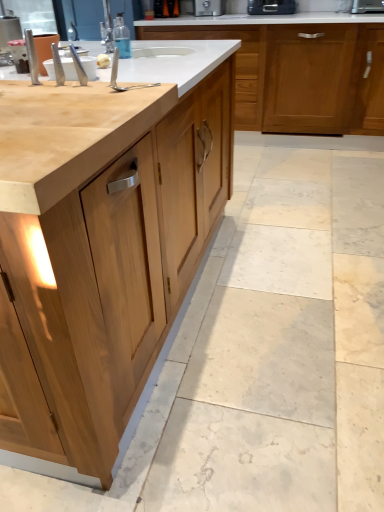
Question: Is natural wood cabinet at center, which is counted as the 2th cabinetry, starting from the back, far from black plastic toaster at upper center, which ranks as the 1th appliance in left-to-right order?

Choices:
 (A) no
 (B) yes

Answer: (B)

Question: Can black plastic toaster at upper center, which ranks as the 1th appliance in left-to-right order, be found inside natural wood cabinet at center, which is the 1th cabinetry in front-to-back order?

Choices:
 (A) no
 (B) yes

Answer: (A)

Question: From a real-world perspective, is natural wood cabinet at center, which is the 1th cabinetry in front-to-back order, below black plastic toaster at upper center, which ranks as the 1th appliance in left-to-right order?

Choices:
 (A) no
 (B) yes

Answer: (B)

Question: Is natural wood cabinet at center, which is the 1th cabinetry in front-to-back order, further to camera compared to black plastic toaster at upper center, which ranks as the 1th appliance in left-to-right order?

Choices:
 (A) no
 (B) yes

Answer: (A)

Question: Considering the relative sizes of natural wood cabinet at center, which is counted as the 2th cabinetry, starting from the back, and black plastic toaster at upper center, which ranks as the 1th appliance in left-to-right order, in the image provided, is natural wood cabinet at center, which is counted as the 2th cabinetry, starting from the back, thinner than black plastic toaster at upper center, which ranks as the 1th appliance in left-to-right order,?

Choices:
 (A) yes
 (B) no

Answer: (B)

Question: Visually, is transparent plastic bottle at upper center positioned to the left or to the right of matte wood cabinet at center, the first cabinetry positioned from the back?

Choices:
 (A) left
 (B) right

Answer: (A)

Question: Considering the positions of point (127, 53) and point (258, 78), is point (127, 53) closer or farther from the camera than point (258, 78)?

Choices:
 (A) farther
 (B) closer

Answer: (B)

Question: Is transparent plastic bottle at upper center in front of or behind matte wood cabinet at center, the first cabinetry positioned from the back, in the image?

Choices:
 (A) front
 (B) behind

Answer: (A)

Question: Is transparent plastic bottle at upper center bigger or smaller than matte wood cabinet at center, the first cabinetry positioned from the back?

Choices:
 (A) small
 (B) big

Answer: (A)

Question: Is matte wood cabinet at center, the first cabinetry positioned from the back, inside the boundaries of transparent plastic bottle at upper center, or outside?

Choices:
 (A) outside
 (B) inside

Answer: (A)

Question: In the image, is matte wood cabinet at center, the first cabinetry positioned from the back, on the left side or the right side of transparent plastic bottle at upper center?

Choices:
 (A) left
 (B) right

Answer: (B)

Question: Looking at their shapes, would you say matte wood cabinet at center, the first cabinetry positioned from the back, is wider or thinner than transparent plastic bottle at upper center?

Choices:
 (A) thin
 (B) wide

Answer: (B)

Question: In terms of size, does matte wood cabinet at center, the 2th cabinetry in the front-to-back sequence, appear bigger or smaller than transparent plastic bottle at upper center?

Choices:
 (A) small
 (B) big

Answer: (B)

Question: Considering the positions of point (253, 47) and point (357, 2), is point (253, 47) closer or farther from the camera than point (357, 2)?

Choices:
 (A) closer
 (B) farther

Answer: (B)

Question: From the image's perspective, is matte wood cabinet at center, the 2th cabinetry in the front-to-back sequence, located above or below metallic silver toaster at upper right, which is the second appliance in left-to-right order?

Choices:
 (A) above
 (B) below

Answer: (B)